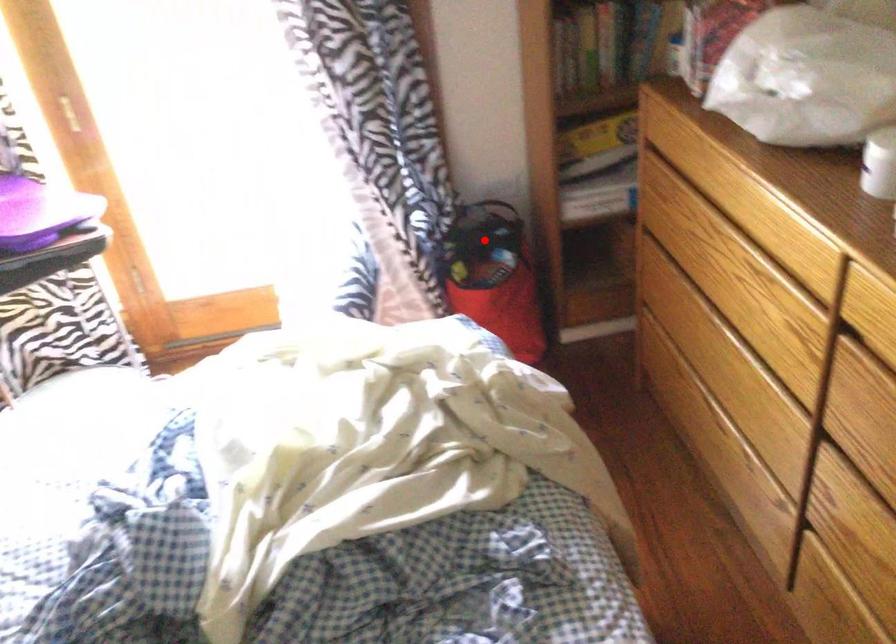
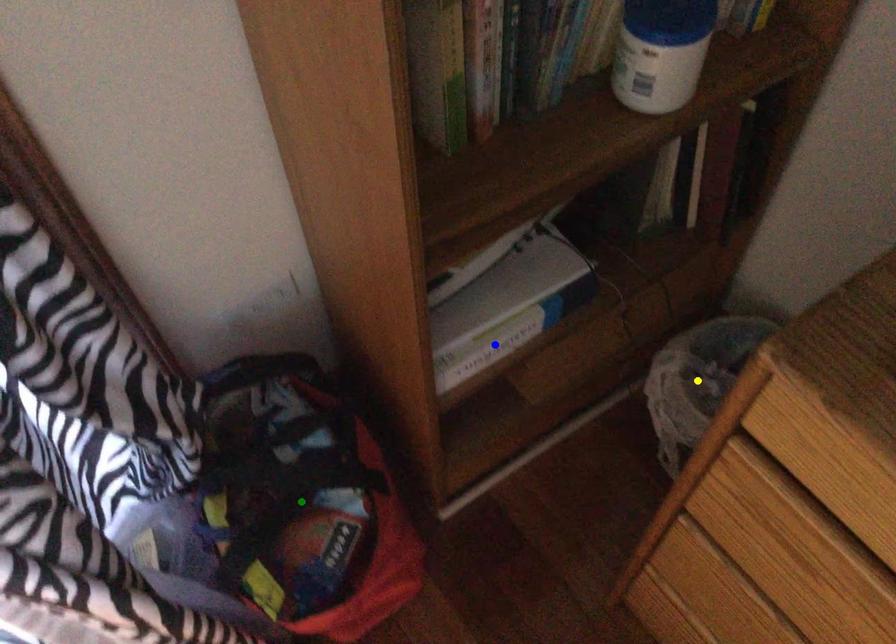
Question: I am providing you with two images of the same scene from different viewpoints. A red point is marked on the first image. You are given multiple points on the second image. Which spot in image 2 lines up with the point in image 1?

Choices:
 (A) green point
 (B) blue point
 (C) yellow point

Answer: (A)